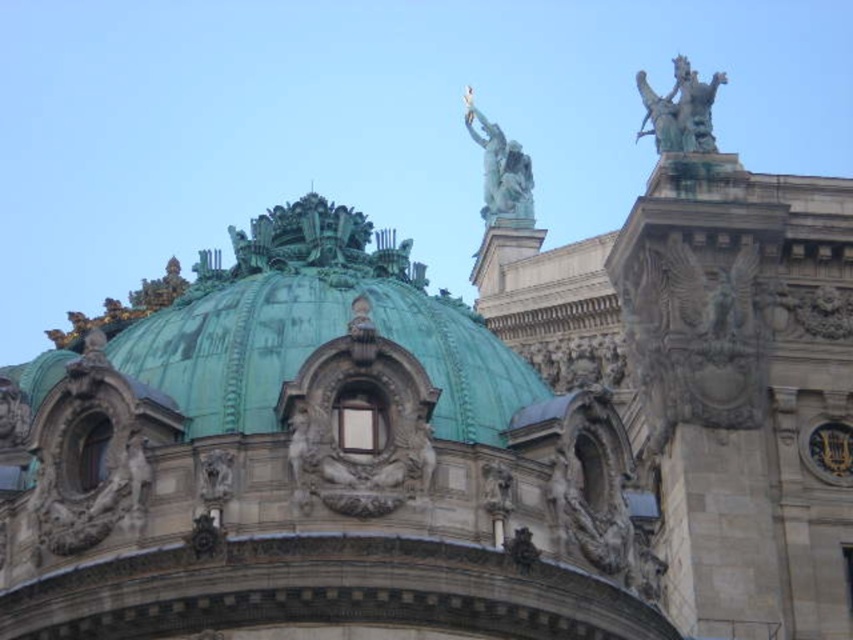
Between green patina statue at upper right and green patina statue at upper center, which one appears on the right side from the viewer's perspective?

From the viewer's perspective, green patina statue at upper right appears more on the right side.

Locate an element on the screen. The width and height of the screenshot is (853, 640). green patina statue at upper right is located at coordinates (680, 109).

Measure the distance between point (277, 376) and camera.

Point (277, 376) and camera are 60.94 meters apart from each other.

Is point (448, 390) positioned behind point (506, 150)?

No, it is in front of (506, 150).

Consider the image. Who is more distant from viewer, [229,372] or [496,161]?

Positioned behind is point [496,161].

At what (x,y) coordinates should I click in order to perform the action: click on green patina dome at center. Please return your answer as a coordinate pair (x, y). This screenshot has width=853, height=640. Looking at the image, I should click on (314, 328).

Is point (277, 298) farther from camera compared to point (693, 84)?

No, it is in front of (693, 84).

Who is positioned more to the right, green patina dome at center or green patina statue at upper right?

→ green patina statue at upper right

Who is more forward, [111,337] or [666,109]?

Point [666,109] is more forward.

The height and width of the screenshot is (640, 853). What are the coordinates of `green patina dome at center` in the screenshot? It's located at (314, 328).